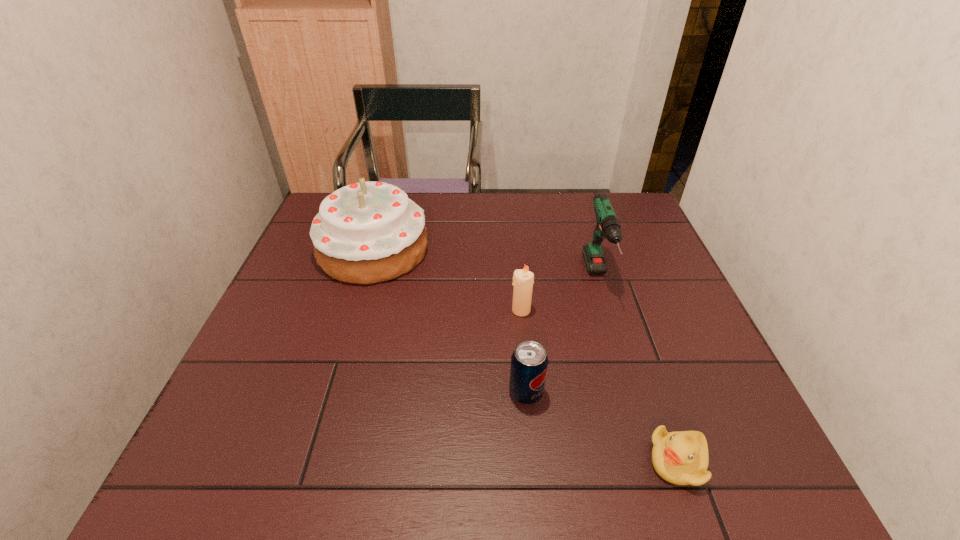
Where is `vacant space in between the leftmost object and the fourth tallest object`? This screenshot has width=960, height=540. vacant space in between the leftmost object and the fourth tallest object is located at coordinates (449, 321).

Identify the location of blank region between the leftmost object and the candle. The height and width of the screenshot is (540, 960). (447, 280).

Where is `free spot between the drill and the soda can`? free spot between the drill and the soda can is located at coordinates (x=562, y=336).

Where is `free space between the duckling and the candle`? This screenshot has height=540, width=960. free space between the duckling and the candle is located at coordinates (599, 386).

At what (x,y) coordinates should I click in order to perform the action: click on the closest object to the nearest object. Please return your answer as a coordinate pair (x, y). Looking at the image, I should click on (529, 362).

Find the location of `object that is the nearest to the nearest object`. object that is the nearest to the nearest object is located at coordinates (529, 362).

The image size is (960, 540). What are the coordinates of `vacant space that satisfies the following two spatial constraints: 1. on the front side of the leftmost object; 2. on the left side of the candle` in the screenshot? It's located at (355, 310).

You are a GUI agent. You are given a task and a screenshot of the screen. Output one action in this format:
    pyautogui.click(x=<x>, y=<y>)
    Task: Click on the vacant point that satisfies the following two spatial constraints: 1. on the front side of the leftmost object; 2. on the right side of the soda can
    
    Given the screenshot: What is the action you would take?
    pyautogui.click(x=330, y=393)